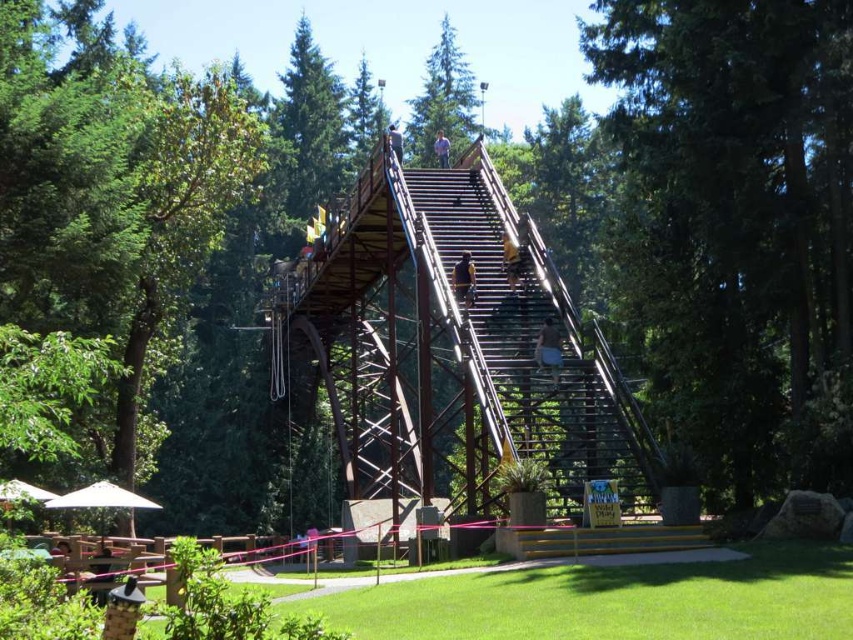
The height and width of the screenshot is (640, 853). Describe the element at coordinates (737, 228) in the screenshot. I see `green leafy tree at upper center` at that location.

Can you confirm if green leafy tree at upper center is taller than metallic silver helmet at upper center?

Correct, green leafy tree at upper center is much taller as metallic silver helmet at upper center.

Is point (653, 28) in front of point (519, 266)?

Yes, it is.

Where is `green leafy tree at upper center`? green leafy tree at upper center is located at coordinates (737, 228).

Which of these two, metallic silver helmet at center or metallic helmet at lower left, stands taller?

With more height is metallic silver helmet at center.

Between metallic silver helmet at center and metallic helmet at lower left, which one is positioned higher?

metallic silver helmet at center

Where is `metallic silver helmet at center`? This screenshot has width=853, height=640. metallic silver helmet at center is located at coordinates (549, 349).

At what (x,y) coordinates should I click in order to perform the action: click on metallic silver helmet at center. Please return your answer as a coordinate pair (x, y). This screenshot has height=640, width=853. Looking at the image, I should click on (549, 349).

Which is more to the left, green textured pine tree at upper center or dark gray metal person at upper center?

dark gray metal person at upper center is more to the left.

Based on the photo, does green textured pine tree at upper center appear under dark gray metal person at upper center?

No.

Measure the distance between point (436, 90) and camera.

The distance of point (436, 90) from camera is 181.51 meters.

Where is `green textured pine tree at upper center`? green textured pine tree at upper center is located at coordinates (442, 102).